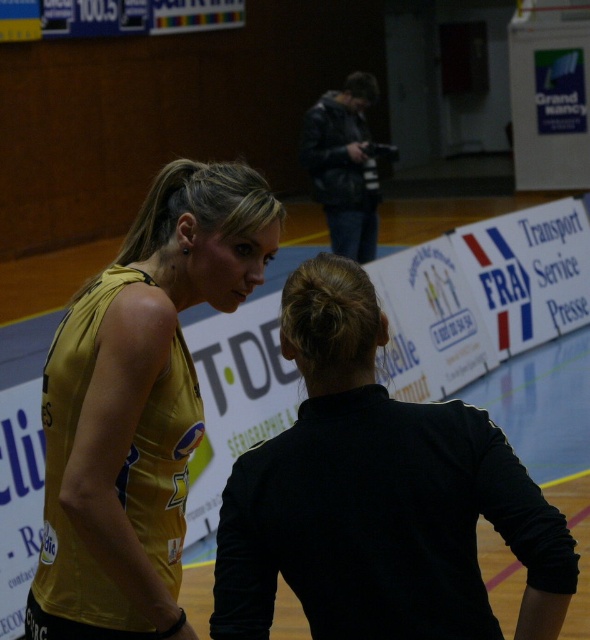
Question: Which object is farther from the camera taking this photo?

Choices:
 (A) gold jersey at left
 (B) dark gray leather jacket at upper center

Answer: (B)

Question: Can you confirm if gold jersey at left is smaller than dark gray leather jacket at upper center?

Choices:
 (A) no
 (B) yes

Answer: (A)

Question: Which point appears closest to the camera in this image?

Choices:
 (A) (132, 544)
 (B) (314, 108)

Answer: (A)

Question: Is the position of gold jersey at left less distant than that of dark gray leather jacket at upper center?

Choices:
 (A) yes
 (B) no

Answer: (A)

Question: Is gold jersey at left wider than dark gray leather jacket at upper center?

Choices:
 (A) yes
 (B) no

Answer: (A)

Question: Among these objects, which one is nearest to the camera?

Choices:
 (A) dark gray leather jacket at upper center
 (B) gold jersey at left

Answer: (B)